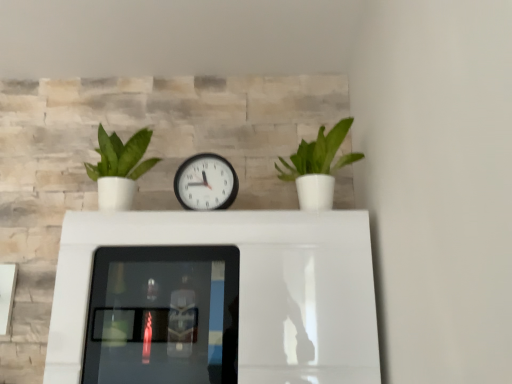
Question: Is point (215, 261) positioned closer to the camera than point (129, 195)?

Choices:
 (A) farther
 (B) closer

Answer: (A)

Question: Is white glossy table at center inside or outside of green matte plant at left, the first houseplant from the left?

Choices:
 (A) inside
 (B) outside

Answer: (B)

Question: Which of these objects is positioned farthest from the green matte plant at right, the second houseplant when ordered from left to right?

Choices:
 (A) white glossy table at center
 (B) white plastic wall clock at center
 (C) green matte plant at left, the second houseplant in the right-to-left sequence

Answer: (C)

Question: Based on their relative distances, which object is nearer to the white glossy table at center?

Choices:
 (A) green matte plant at right, which appears as the 1th houseplant when viewed from the right
 (B) white plastic wall clock at center
 (C) green matte plant at left, the second houseplant in the right-to-left sequence

Answer: (B)